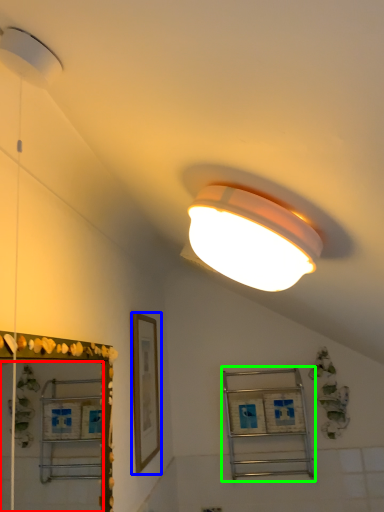
Question: Which is farther away from mirror (highlighted by a red box)? picture frame (highlighted by a blue box) or shelf (highlighted by a green box)?

Choices:
 (A) picture frame
 (B) shelf

Answer: (B)